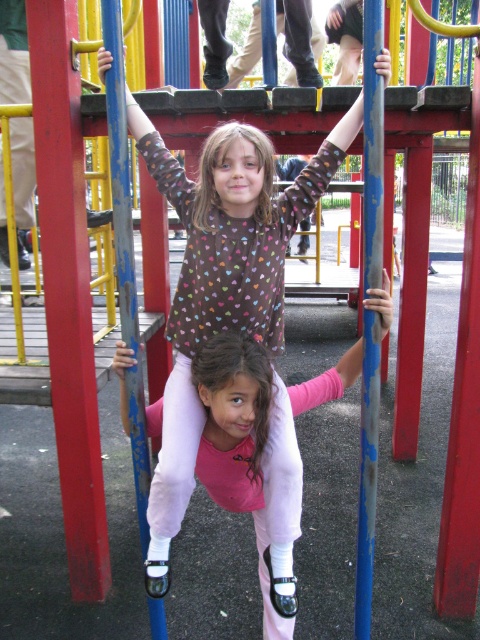
Question: Does brown dotted sweater at center appear on the right side of blue painted metal pole at center?

Choices:
 (A) yes
 (B) no

Answer: (B)

Question: Can you confirm if brown dotted sweater at center is positioned below blue painted metal pole at center?

Choices:
 (A) no
 (B) yes

Answer: (A)

Question: Which object is farther from the camera taking this photo?

Choices:
 (A) brown dotted sweater at center
 (B) blue painted metal pole at center

Answer: (A)

Question: Which point is closer to the camera taking this photo?

Choices:
 (A) (359, 625)
 (B) (190, 292)

Answer: (B)

Question: Can you confirm if brown dotted sweater at center is positioned above blue painted metal pole at center?

Choices:
 (A) no
 (B) yes

Answer: (B)